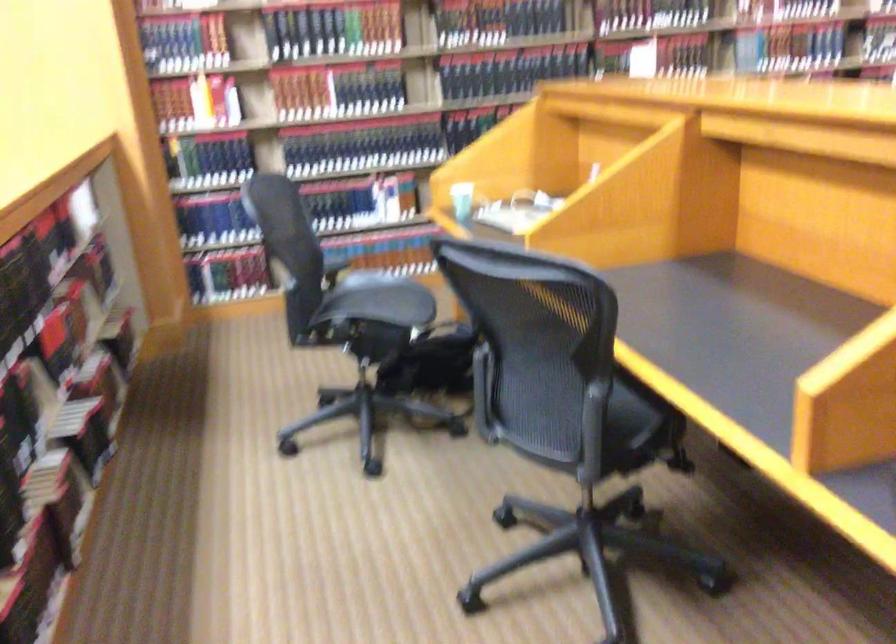
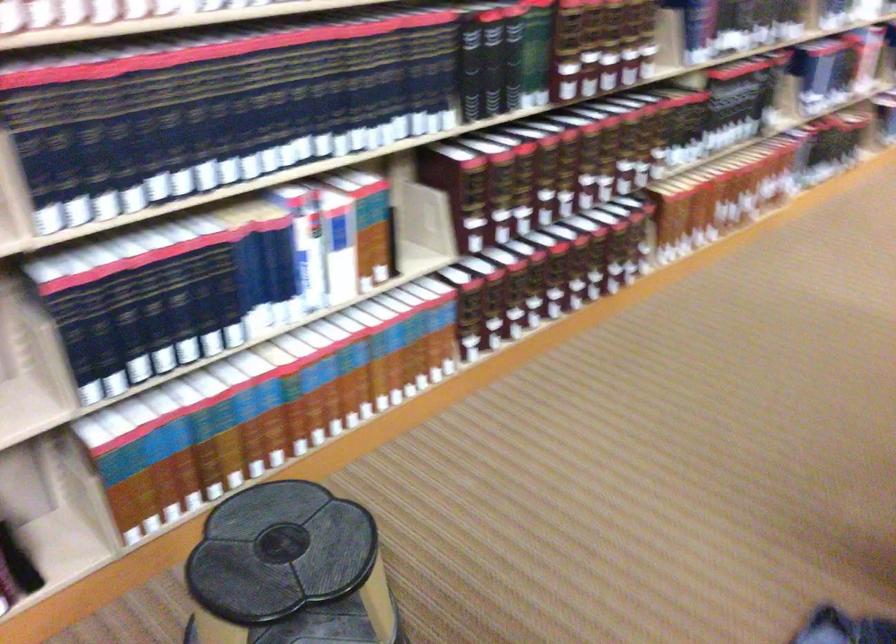
The point at (330, 200) is marked in the first image. Where is the corresponding point in the second image?

(200, 290)